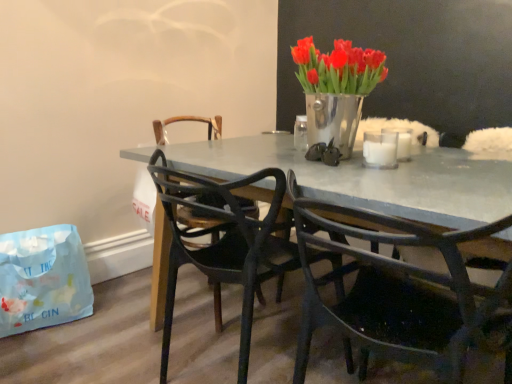
Question: From a real-world perspective, is metallic silver vase at upper center under light blue paper bag at lower left?

Choices:
 (A) no
 (B) yes

Answer: (A)

Question: Does metallic silver vase at upper center turn towards light blue paper bag at lower left?

Choices:
 (A) yes
 (B) no

Answer: (B)

Question: Is metallic silver vase at upper center shorter than light blue paper bag at lower left?

Choices:
 (A) no
 (B) yes

Answer: (B)

Question: Can you confirm if metallic silver vase at upper center is taller than light blue paper bag at lower left?

Choices:
 (A) no
 (B) yes

Answer: (A)

Question: Is the position of metallic silver vase at upper center more distant than that of light blue paper bag at lower left?

Choices:
 (A) yes
 (B) no

Answer: (B)

Question: Considering the relative positions of metallic silver vase at upper center and light blue paper bag at lower left in the image provided, is metallic silver vase at upper center in front of light blue paper bag at lower left?

Choices:
 (A) no
 (B) yes

Answer: (B)

Question: Can you confirm if white frosted glass candle at upper right, placed as the 1th candle when sorted from back to front, is bigger than metallic silver vase at upper center?

Choices:
 (A) yes
 (B) no

Answer: (B)

Question: Does white frosted glass candle at upper right, placed as the 1th candle when sorted from back to front, come behind metallic silver vase at upper center?

Choices:
 (A) yes
 (B) no

Answer: (A)

Question: From the image's perspective, is white frosted glass candle at upper right, placed as the 1th candle when sorted from back to front, over metallic silver vase at upper center?

Choices:
 (A) no
 (B) yes

Answer: (A)

Question: Can you confirm if white frosted glass candle at upper right, positioned as the 2th candle in front-to-back order, is thinner than metallic silver vase at upper center?

Choices:
 (A) no
 (B) yes

Answer: (B)

Question: Does white frosted glass candle at upper right, positioned as the 2th candle in front-to-back order, appear on the left side of metallic silver vase at upper center?

Choices:
 (A) no
 (B) yes

Answer: (A)

Question: Is white frosted glass candle at upper right, positioned as the 2th candle in front-to-back order, located outside metallic silver vase at upper center?

Choices:
 (A) no
 (B) yes

Answer: (B)

Question: From the image's perspective, does black plastic chair at center, positioned as the second chair in right-to-left order, appear lower than light blue paper bag at lower left?

Choices:
 (A) no
 (B) yes

Answer: (A)